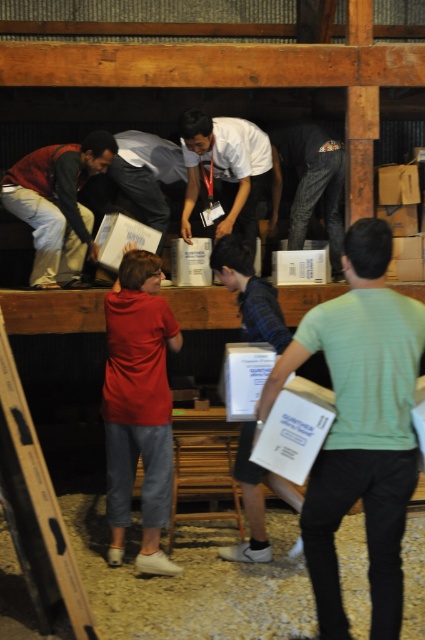
You are a photographer positioned in the rustic wooden structure. You need to capture a photo where both the matte brown jacket at left and the white matte shirt at center are clearly visible. Considering their heights, which subject should you focus on first to ensure both are in frame?

The matte brown jacket at left is taller than the white matte shirt at center. To ensure both are in frame, focus on the taller matte brown jacket at left first, then adjust the camera angle to include the shorter white matte shirt at center.

You are standing at the entrance of the barn and want to reach the point marked as point (107,147). If you walk directly towards it, how far will you have to walk?

The distance between you and point (107,147) is 5.02 meters, so you will have to walk 5.02 meters to reach it.